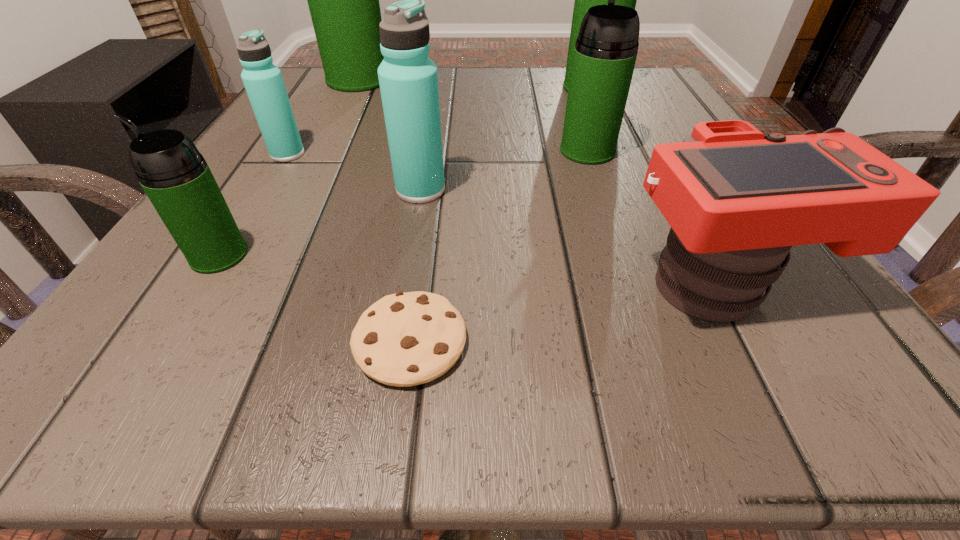
Find the location of `the tallest thermos bottle`. the tallest thermos bottle is located at coordinates tap(343, 0).

Where is `the biggest green thermos bottle`? the biggest green thermos bottle is located at coordinates (343, 0).

Find the location of a particular element. This screenshot has height=540, width=960. the fifth shortest thermos bottle is located at coordinates (584, 0).

Where is `the seventh shortest object`? This screenshot has height=540, width=960. the seventh shortest object is located at coordinates [584, 0].

This screenshot has width=960, height=540. Find the location of `the third biggest green thermos bottle`. the third biggest green thermos bottle is located at coordinates (606, 48).

I want to click on the bigger aqua thermos bottle, so click(408, 78).

The image size is (960, 540). Find the location of `the right aqua thermos bottle`. the right aqua thermos bottle is located at coordinates 408,78.

Find the location of a particular element. The height and width of the screenshot is (540, 960). the left aqua thermos bottle is located at coordinates (263, 81).

Identify the location of the smaller aqua thermos bottle. (263, 81).

Locate an element on the screen. The image size is (960, 540). the nearest green thermos bottle is located at coordinates (175, 176).